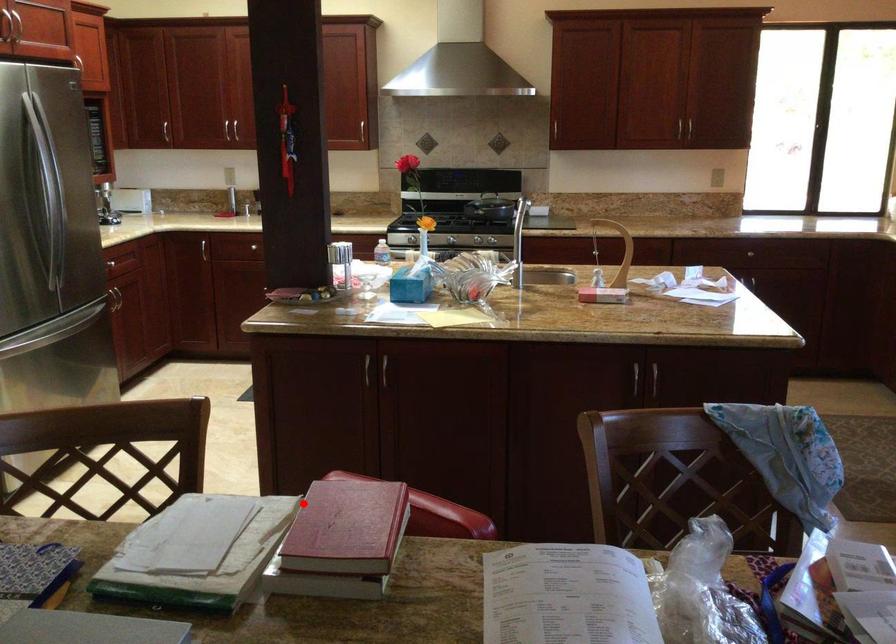
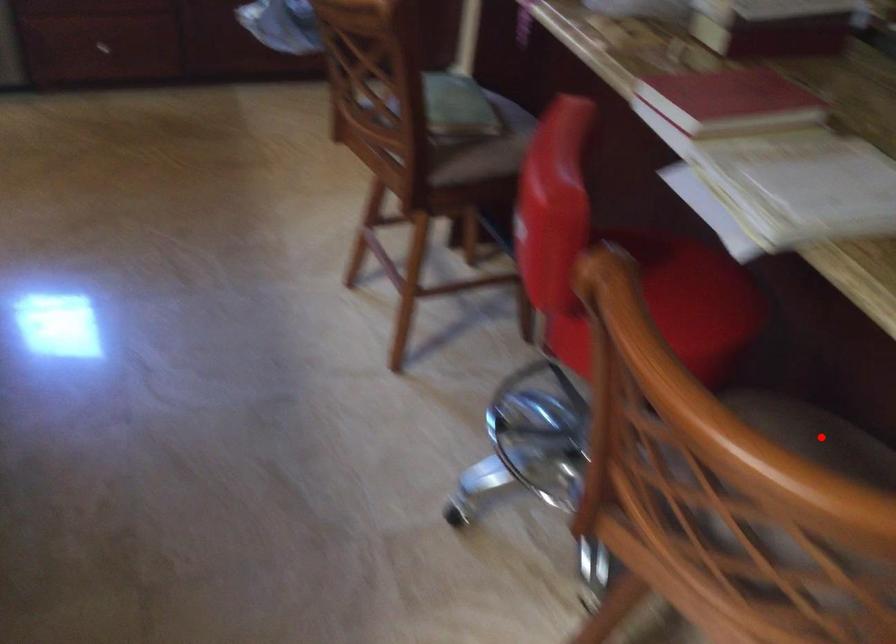
I am providing you with two images of the same scene from different viewpoints. A red point is marked on the first image and another point is marked on the second image. Do the highlighted points in image1 and image2 indicate the same real-world spot?

No